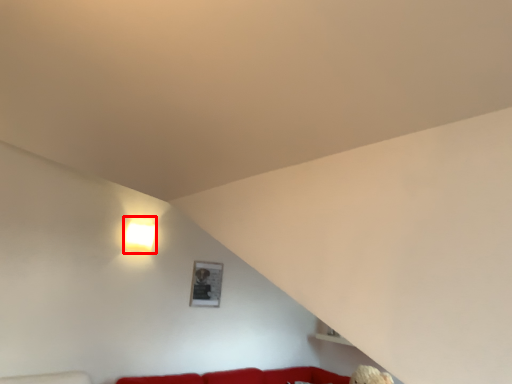
Question: From the image's perspective, where is lamp (annotated by the red box) located relative to picture frame?

Choices:
 (A) above
 (B) below

Answer: (A)